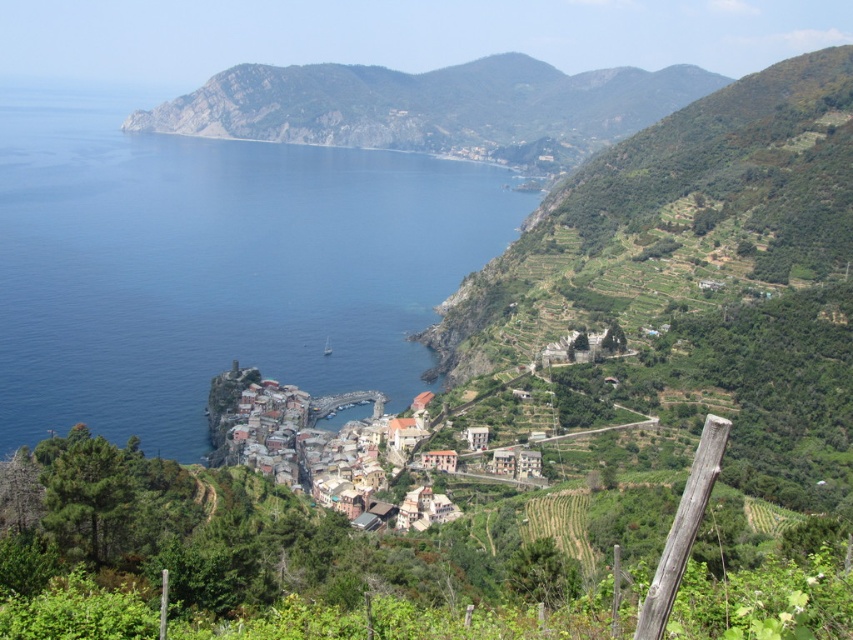
Question: Which of these objects is positioned closest to the terracotta clay houses at center?

Choices:
 (A) blue water at center
 (B) green rocky mountain at upper center

Answer: (A)

Question: Is green rocky mountain at upper center further to camera compared to terracotta clay houses at center?

Choices:
 (A) yes
 (B) no

Answer: (A)

Question: Which of these objects is positioned closest to the green rocky mountain at upper center?

Choices:
 (A) blue water at center
 (B) terracotta clay houses at center

Answer: (A)

Question: Does blue water at center appear under terracotta clay houses at center?

Choices:
 (A) no
 (B) yes

Answer: (A)

Question: Estimate the real-world distances between objects in this image. Which object is closer to the terracotta clay houses at center?

Choices:
 (A) blue water at center
 (B) green rocky mountain at upper center

Answer: (A)

Question: Does blue water at center have a smaller size compared to terracotta clay houses at center?

Choices:
 (A) yes
 (B) no

Answer: (B)